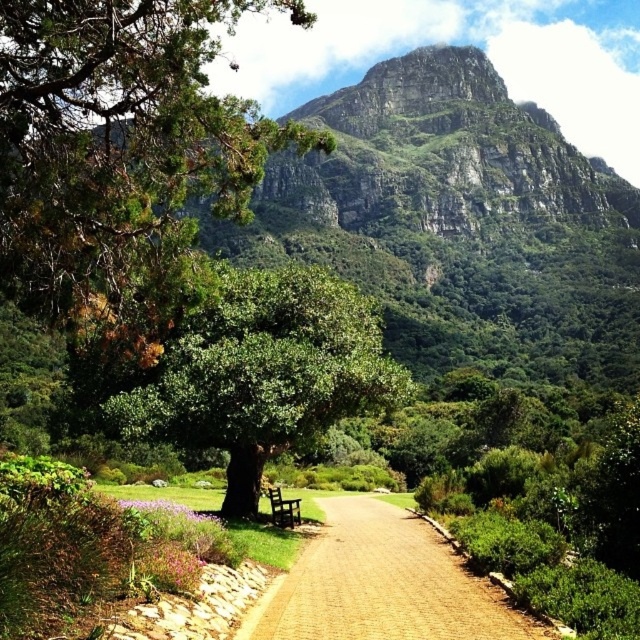
Does green needle-like at upper left have a greater width compared to dark brown wooden bench at center?

Indeed, green needle-like at upper left has a greater width compared to dark brown wooden bench at center.

Does green needle-like at upper left appear on the left side of dark brown wooden bench at center?

Correct, you'll find green needle-like at upper left to the left of dark brown wooden bench at center.

Which is behind, point (38, 189) or point (275, 488)?

The point (275, 488) is more distant.

The height and width of the screenshot is (640, 640). I want to click on green needle-like at upper left, so click(x=118, y=145).

Does brown cobblestone path at center have a smaller size compared to dark brown wooden bench at center?

Incorrect, brown cobblestone path at center is not smaller in size than dark brown wooden bench at center.

This screenshot has width=640, height=640. Describe the element at coordinates (381, 582) in the screenshot. I see `brown cobblestone path at center` at that location.

The height and width of the screenshot is (640, 640). Find the location of `brown cobblestone path at center`. brown cobblestone path at center is located at coordinates (381, 582).

Between point (144, 428) and point (340, 513), which one is positioned in front?

Point (144, 428)

Describe the element at coordinates (264, 372) in the screenshot. The image size is (640, 640). I see `green leafy tree at center` at that location.

The height and width of the screenshot is (640, 640). What are the coordinates of `green leafy tree at center` in the screenshot? It's located at (264, 372).